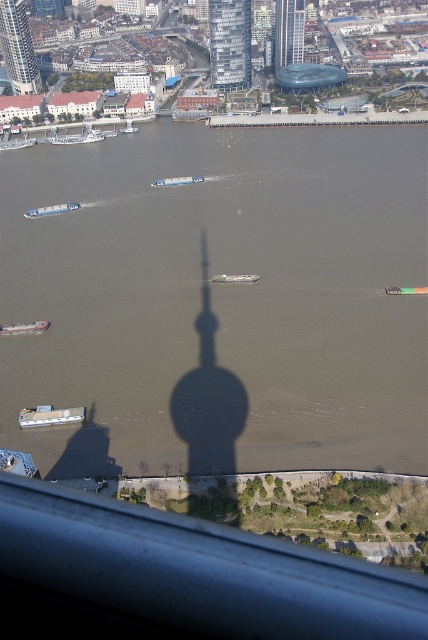
You are a delivery drone operator who needs to fly a drone from the matte gray barge at center to the white plastic boat at center. The drone has a maximum flight range of 80 meters. Can the drone make the trip without needing to recharge?

The matte gray barge at center is 76.49 meters from the white plastic boat at center. Since the distance is less than the drone maximum flight range of 80 meters, the drone can make the trip without needing to recharge.